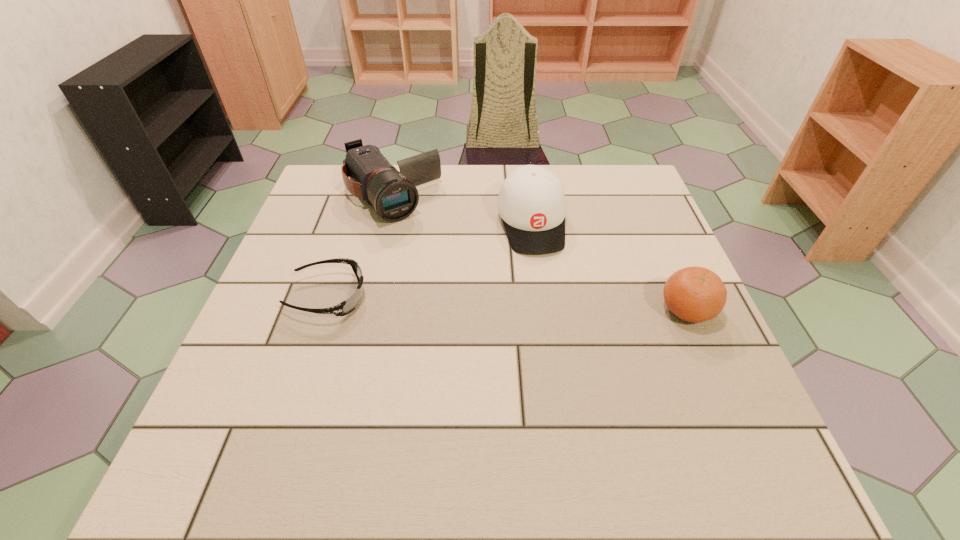
In order to click on vacant space situated 0.100m on the front-facing side of the third object from left to right in this screenshot , I will do `click(546, 287)`.

This screenshot has height=540, width=960. I want to click on vacant space located 0.180m on the front-facing side of the third object from left to right, so [x=553, y=315].

Identify the location of free space located 0.340m on the front-facing side of the third object from left to right. (570, 380).

In order to click on camcorder that is at the far edge in this screenshot , I will do `click(394, 195)`.

Where is `baseball cap present at the far edge`? This screenshot has width=960, height=540. baseball cap present at the far edge is located at coordinates (531, 203).

Locate an element on the screen. The width and height of the screenshot is (960, 540). sunglasses that is positioned at the left edge is located at coordinates (345, 307).

Where is `camcorder at the left edge`? The height and width of the screenshot is (540, 960). camcorder at the left edge is located at coordinates (394, 195).

In order to click on object located in the right edge section of the desktop in this screenshot , I will do `click(694, 294)`.

The width and height of the screenshot is (960, 540). Find the location of `object that is at the far left corner`. object that is at the far left corner is located at coordinates pyautogui.click(x=394, y=195).

Image resolution: width=960 pixels, height=540 pixels. In the image, there is a desktop. Identify the location of vacant region at the far edge. (437, 180).